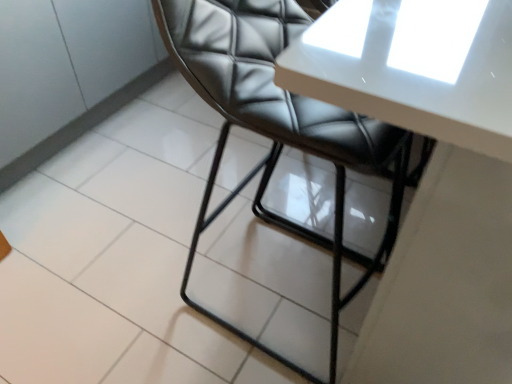
Where is `vacant space behind black leather chair at center`? vacant space behind black leather chair at center is located at coordinates (267, 200).